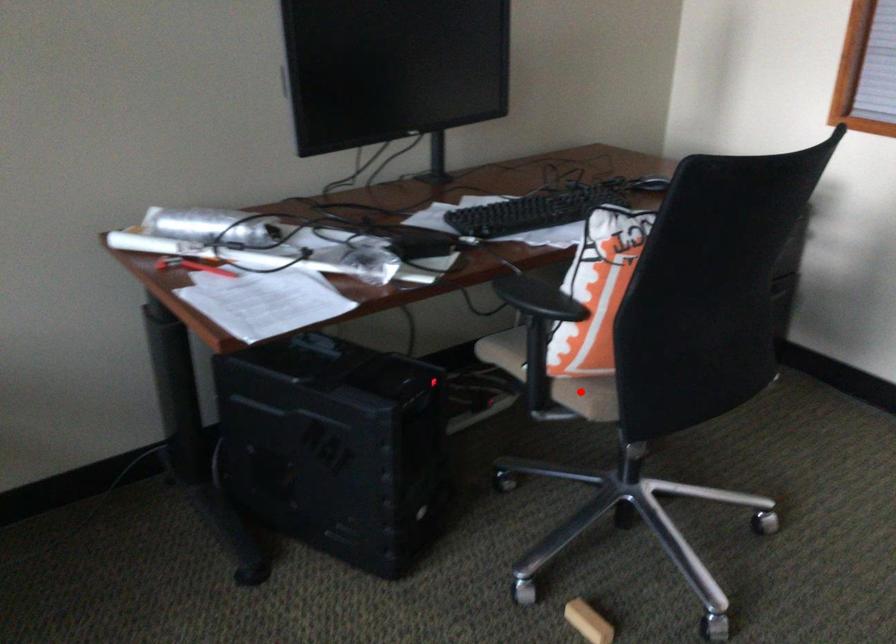
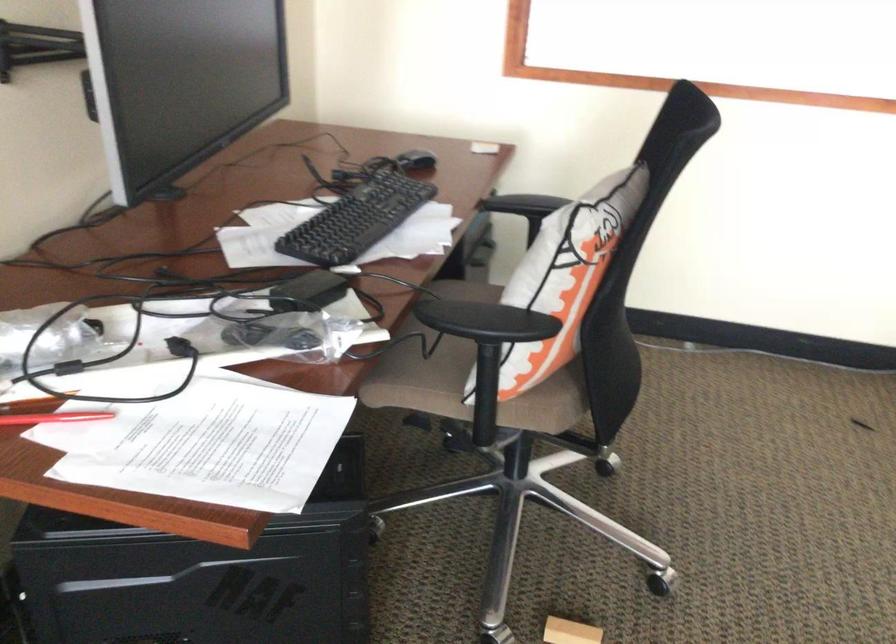
The point at the highlighted location is marked in the first image. Where is the corresponding point in the second image?

(543, 408)